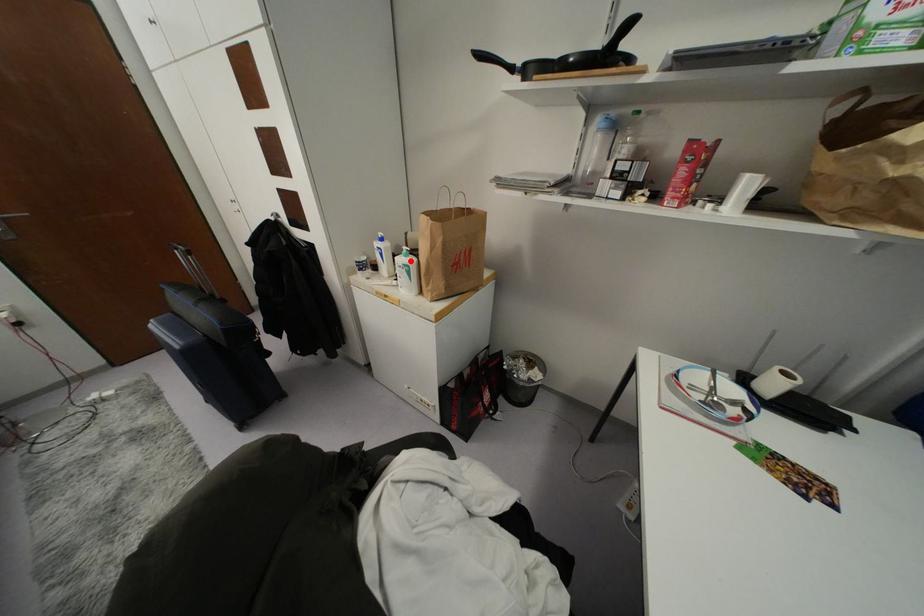
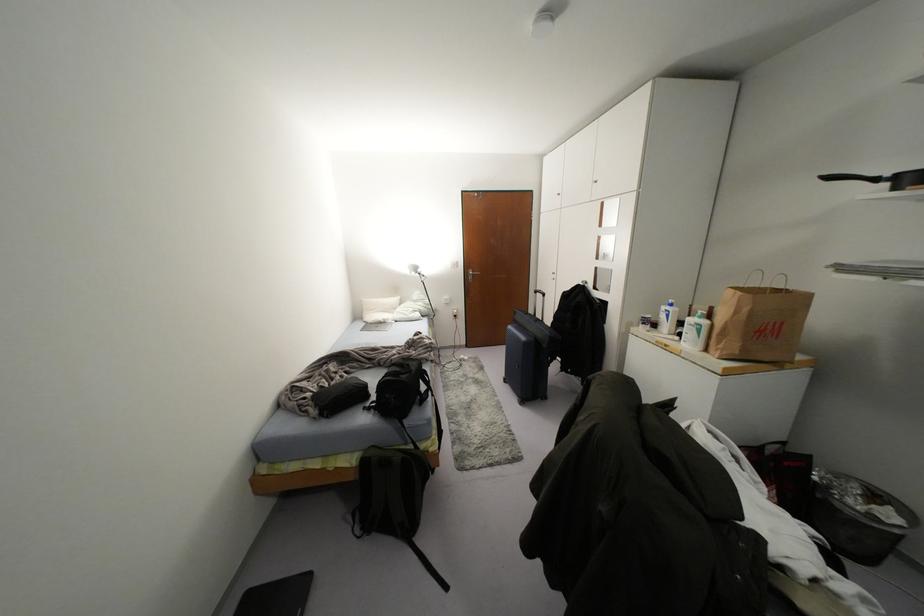
Question: I am providing you with two images of the same scene from different viewpoints. Given a red point in image1, look at the same physical point in image2. Is it:

Choices:
 (A) Closer to the viewpoint
 (B) Farther from the viewpoint

Answer: (A)